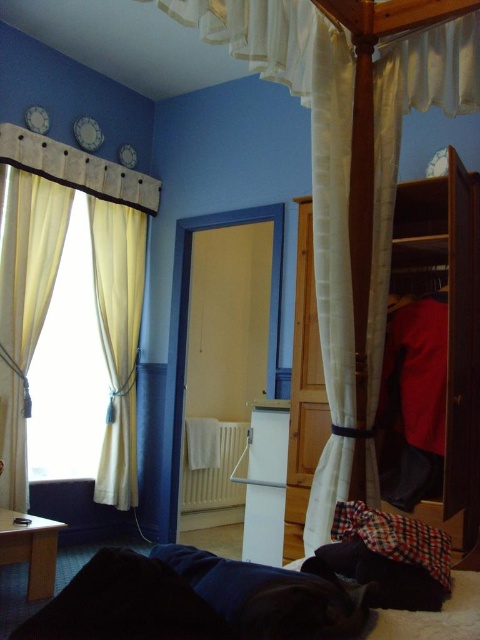
Question: Which point is closer to the camera?

Choices:
 (A) (455, 276)
 (B) (41, 188)
 (C) (99, 337)
 (D) (67, 378)

Answer: (A)

Question: Can you confirm if light beige curtain at left is thinner than matte white curtain at left?

Choices:
 (A) yes
 (B) no

Answer: (B)

Question: In this image, where is light beige curtain at left located relative to matte cream curtain at left?

Choices:
 (A) left
 (B) right

Answer: (B)

Question: Which point appears closest to the camera in this image?

Choices:
 (A) tap(100, 497)
 (B) tap(16, 186)
 (C) tap(86, 234)

Answer: (B)

Question: Considering the real-world distances, which object is closest to the light beige curtain at left?

Choices:
 (A) matte cream curtain at left
 (B) wooden wardrobe at right

Answer: (A)

Question: Can you confirm if wooden wardrobe at right is positioned below light beige curtain at left?

Choices:
 (A) no
 (B) yes

Answer: (A)